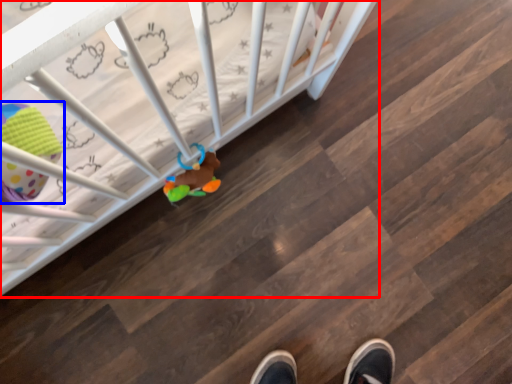
Question: Which object is closer to the camera taking this photo, infant bed (highlighted by a red box) or toy (highlighted by a blue box)?

Choices:
 (A) infant bed
 (B) toy

Answer: (B)